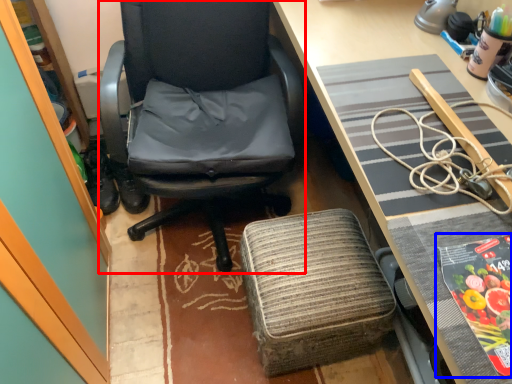
Question: Which object is closer to the camera taking this photo, chair (highlighted by a red box) or paperback book (highlighted by a blue box)?

Choices:
 (A) chair
 (B) paperback book

Answer: (B)